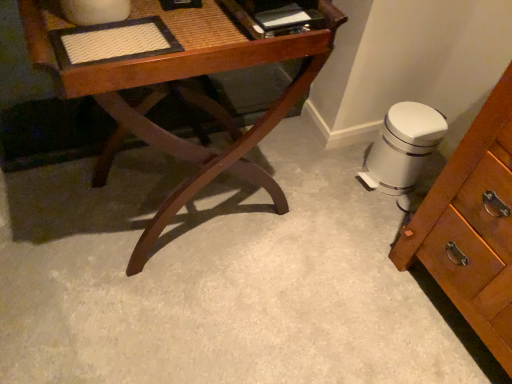
You are a GUI agent. You are given a task and a screenshot of the screen. Output one action in this format:
    pyautogui.click(x=<x>, y=<y>)
    Task: Click on the free space in front of glossy wood desk at center
    The height and width of the screenshot is (384, 512).
    Given the screenshot: What is the action you would take?
    pyautogui.click(x=155, y=311)